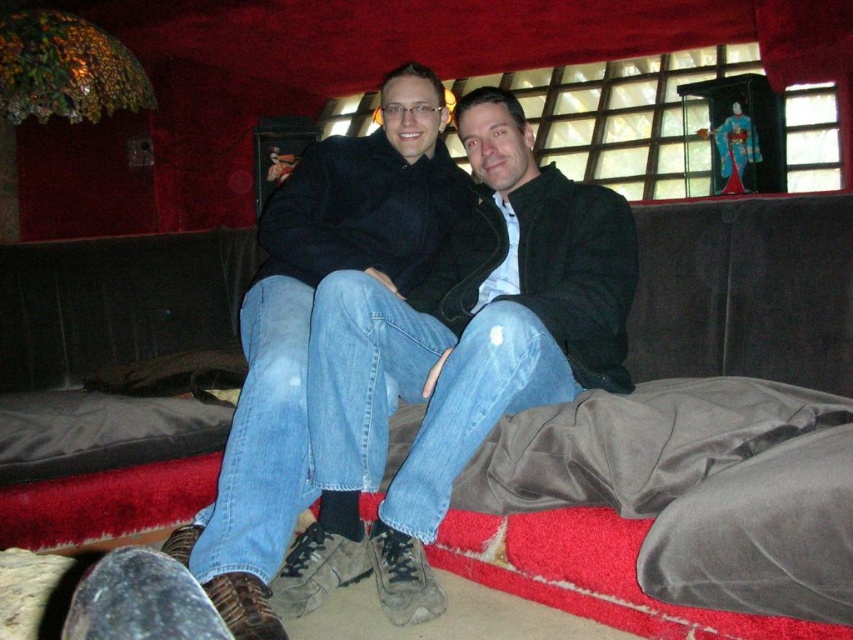
Can you confirm if velvet dark brown couch at center is taller than jeans at center?

No, velvet dark brown couch at center is not taller than jeans at center.

Which is more to the right, velvet dark brown couch at center or jeans at center?

jeans at center

Which is in front, point (689, 211) or point (277, 588)?

Point (277, 588) is in front.

Locate an element on the screen. velvet dark brown couch at center is located at coordinates (746, 291).